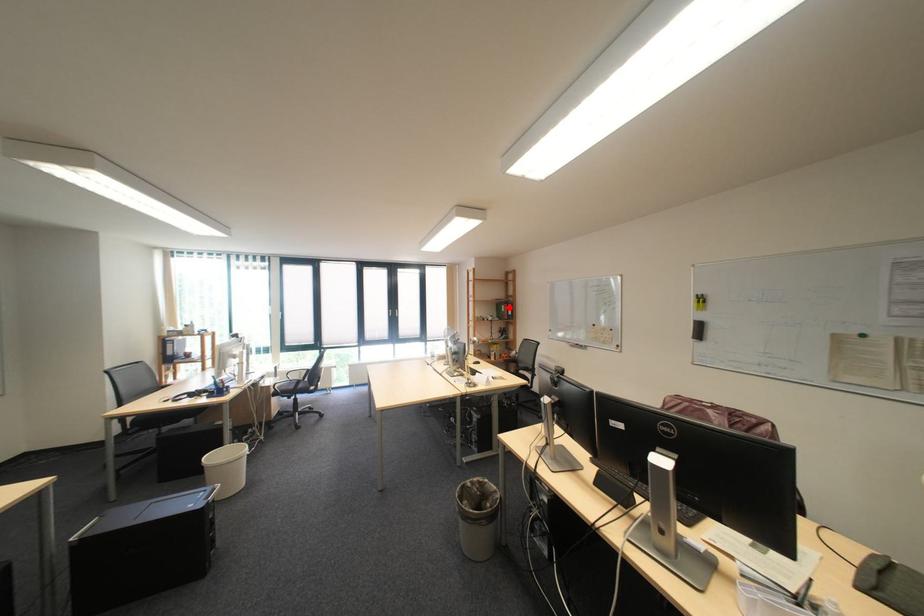
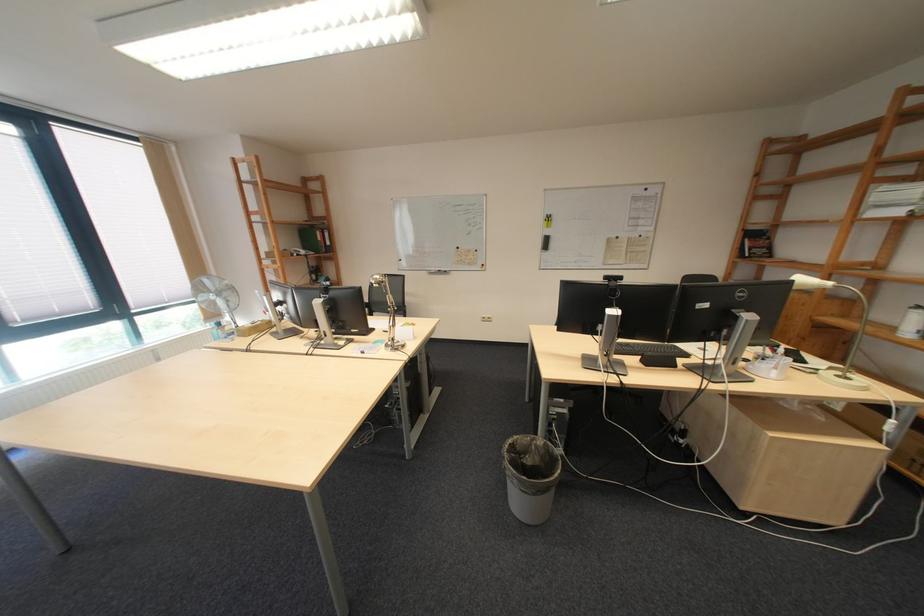
Question: I am providing you with two images of the same scene from different viewpoints. Image1 has a red point marked. In image2, the corresponding 3D location appears at what relative position? Reply with the corresponding letter.

Choices:
 (A) Closer
 (B) Farther

Answer: (A)